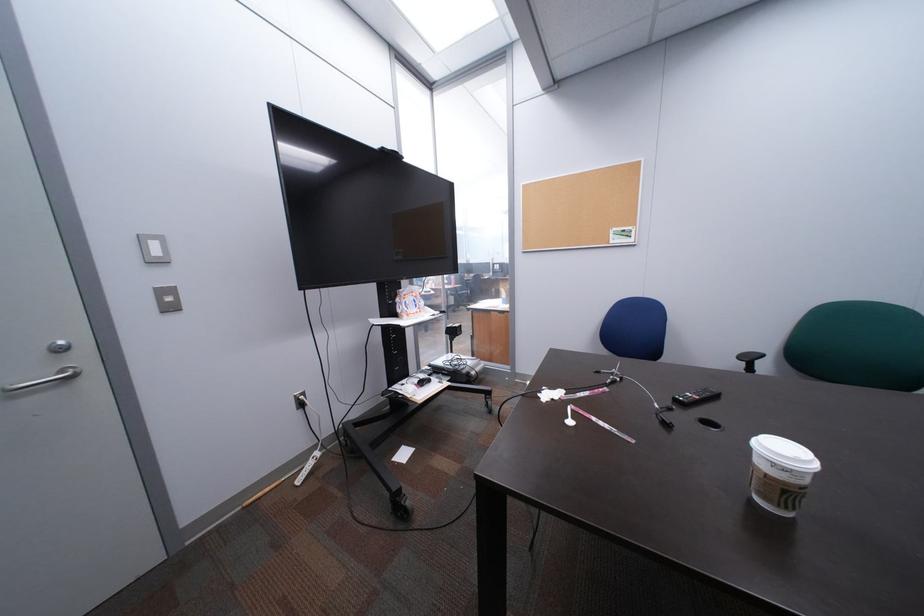
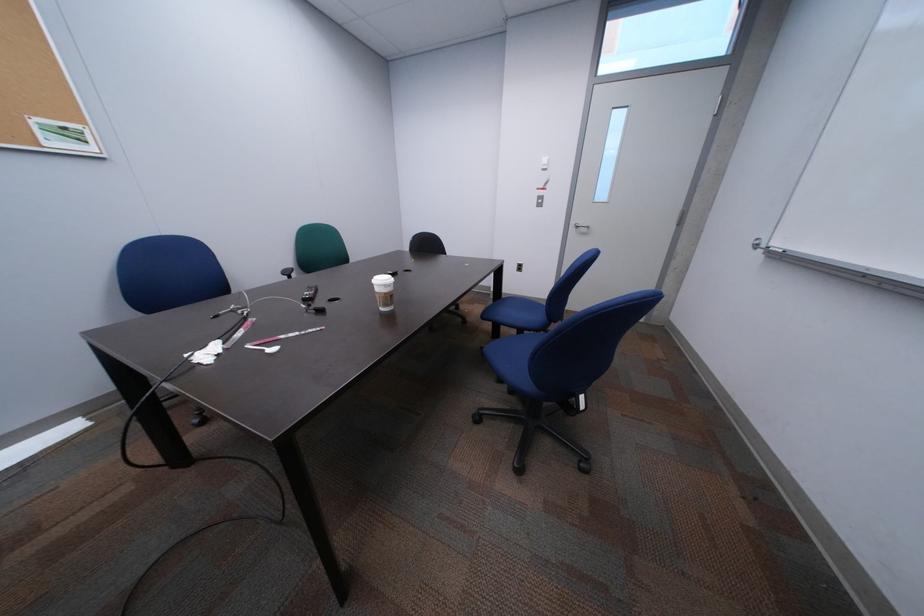
The images are taken continuously from a first-person perspective. In which direction is your viewpoint rotating?

The camera rotated toward right-down.